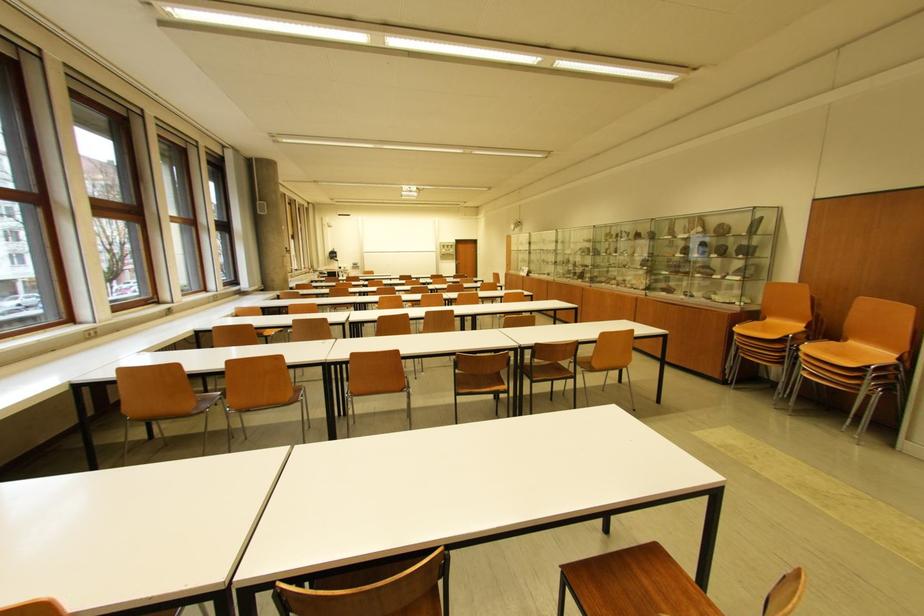
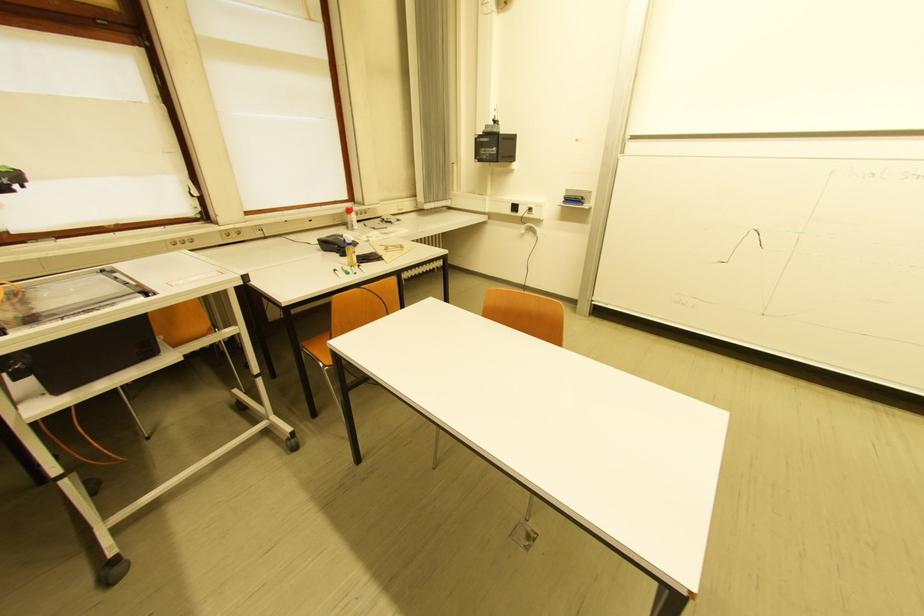
Where in the second image is the point corresponding to pixel 360 265 from the first image?

(575, 201)